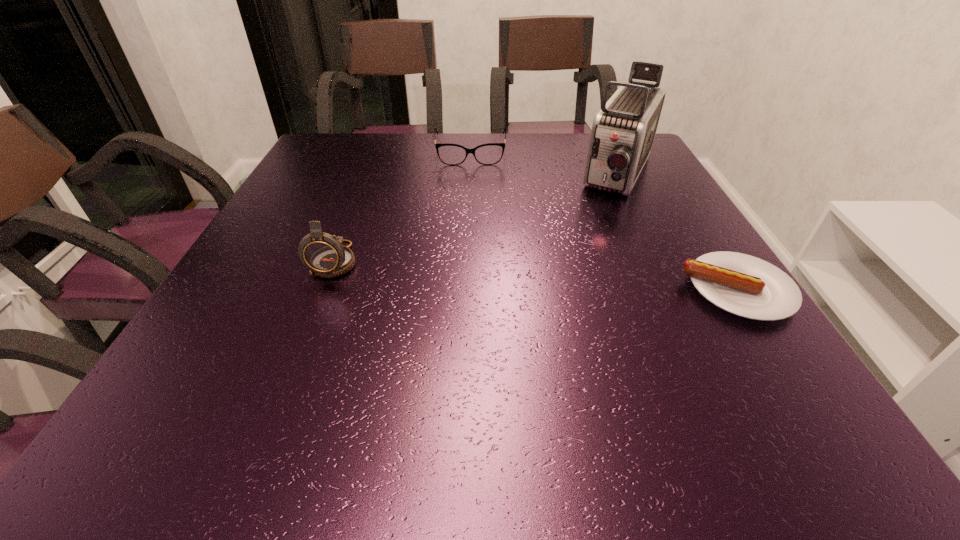
Where is `free space on the desktop that is between the leftmost object and the sausage and is positioned on the front-facing side of the second object from left to right`? free space on the desktop that is between the leftmost object and the sausage and is positioned on the front-facing side of the second object from left to right is located at coordinates (470, 271).

At what (x,y) coordinates should I click in order to perform the action: click on vacant spot on the desktop that is between the leftmost object and the sausage and is positioned at the lens of the camcorder. Please return your answer as a coordinate pair (x, y). This screenshot has width=960, height=540. Looking at the image, I should click on (561, 277).